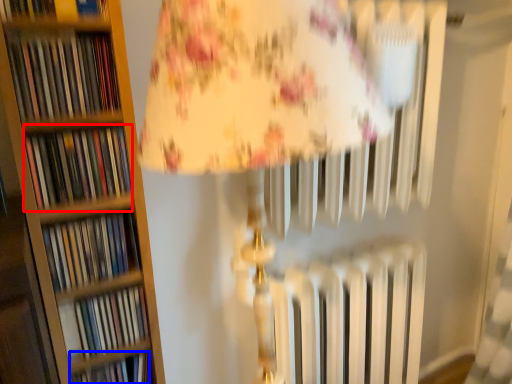
Question: Which object appears farthest to the camera in this image, book (highlighted by a red box) or book (highlighted by a blue box)?

Choices:
 (A) book
 (B) book

Answer: (B)